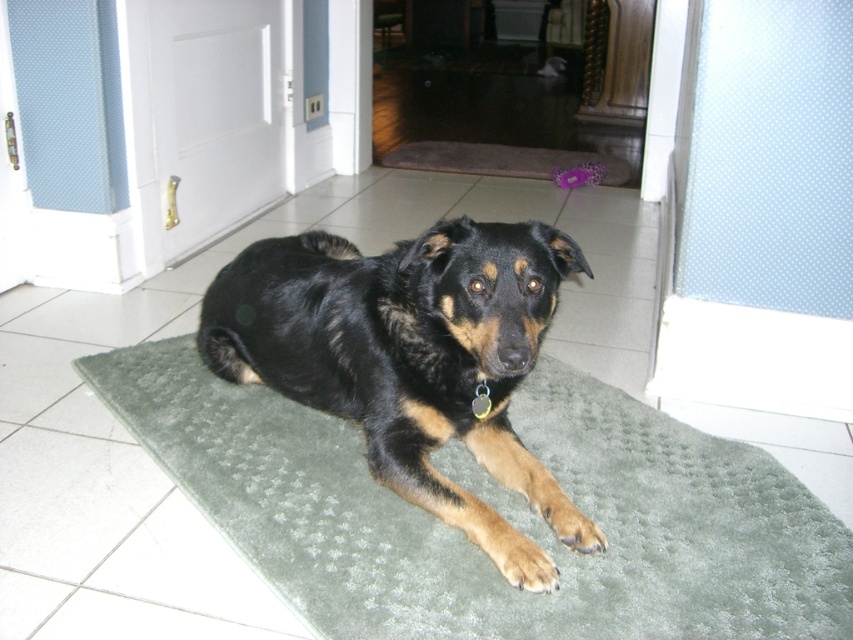
In the scene shown: You are a delivery person approaching the entrance. You see the green textured mat at center and the black fur dog at center. Which object is closer to the door on the left?

The green textured mat at center is in front of the black fur dog at center, so the green textured mat at center is closer to the door on the left.

You are standing at the entrance of the home and want to place a new decorative item on the green textured mat at center. The mat is located at coordinates point (496, 509). If you move 0.1 units to the right from this point, where will you be relative to the white door with brass handle and blue panel at the top?

Moving 0.1 units to the right from point (496, 509) would place you at coordinates 0.897, 0.583. Since the white door with brass handle and blue panel at the top is located to the left of the mat, moving right from the mat would take you away from the door and closer to the opposite wall.

You are standing in the hallway where the dog is lying on the green mat. There are two points marked on the floor. The first point is at coordinates point [527,260] and the second point is at coordinates point [491,148]. Which point is closer to you?

Point [527,260] is closer to the viewer than point [491,148].